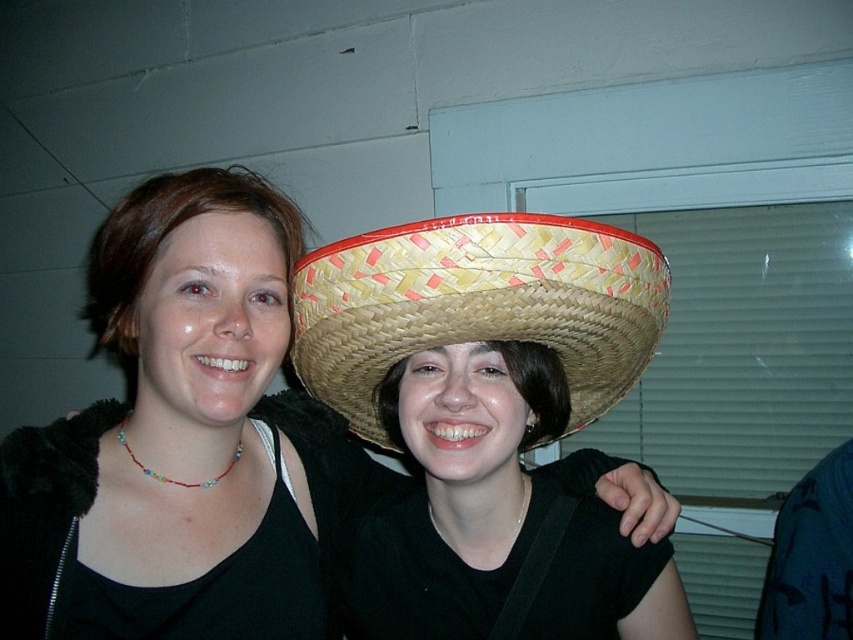
Question: Is matte black tank top at center closer to the viewer compared to woven straw sombrero at center?

Choices:
 (A) yes
 (B) no

Answer: (B)

Question: Which of the following is the closest to the observer?

Choices:
 (A) woven straw sombrero at center
 (B) matte black tank top at center

Answer: (A)

Question: Which point is farther to the camera?

Choices:
 (A) woven straw sombrero at center
 (B) matte black tank top at center

Answer: (B)

Question: Among these points, which one is nearest to the camera?

Choices:
 (A) (392, 308)
 (B) (315, 573)

Answer: (A)

Question: Does matte black tank top at center appear on the right side of woven straw sombrero at center?

Choices:
 (A) yes
 (B) no

Answer: (B)

Question: Considering the relative positions of matte black tank top at center and woven straw sombrero at center in the image provided, where is matte black tank top at center located with respect to woven straw sombrero at center?

Choices:
 (A) left
 (B) right

Answer: (A)